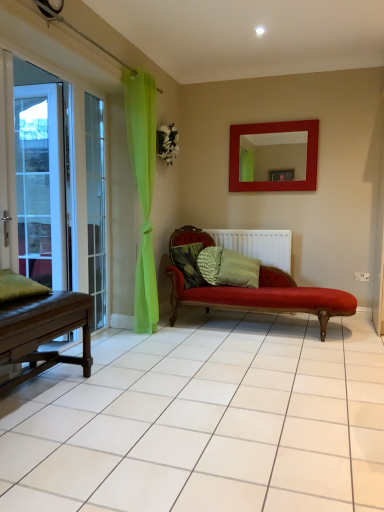
At what (x,y) coordinates should I click in order to perform the action: click on blank space above white glass screen door at left (from a real-world perspective). Please return your answer as a coordinate pair (x, y). This screenshot has height=512, width=384. Looking at the image, I should click on (23, 46).